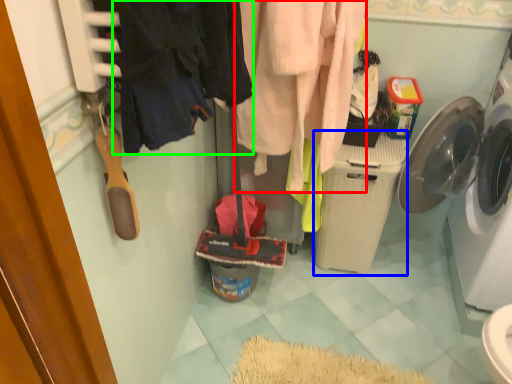
Question: Based on their relative distances, which object is farther from clothing (highlighted by a red box)? Choose from washing machine (highlighted by a blue box) and clothing (highlighted by a green box).

Choices:
 (A) washing machine
 (B) clothing

Answer: (B)